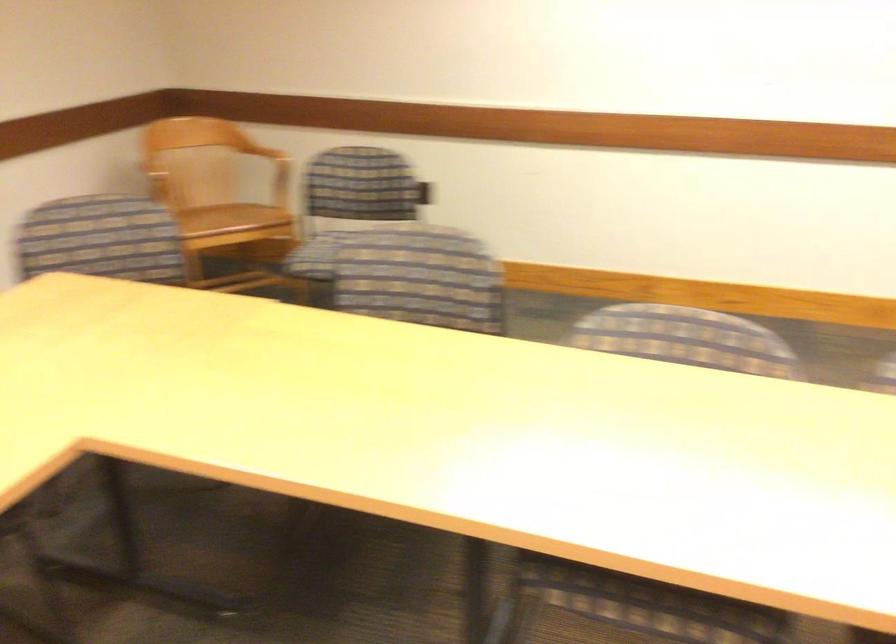
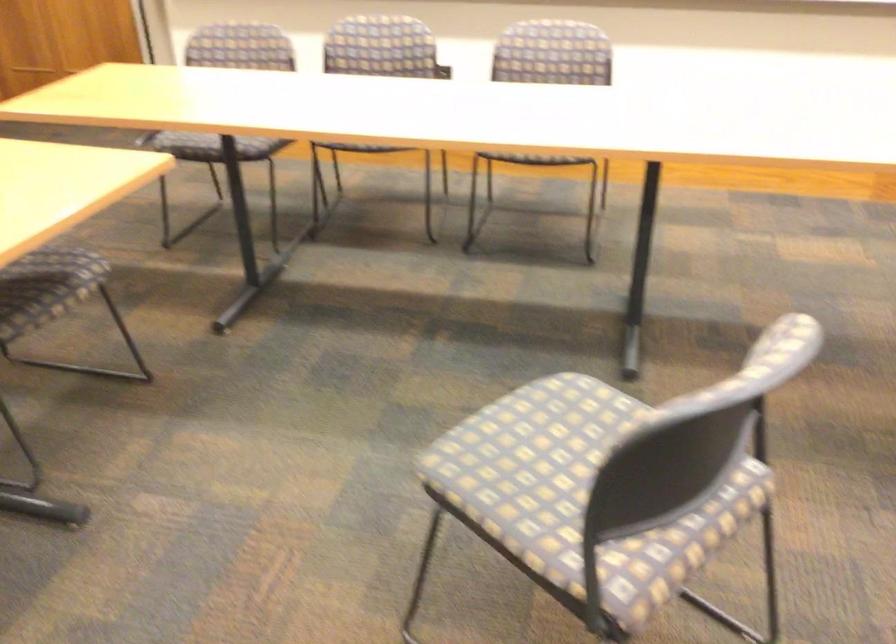
First-person continuous shooting, in which direction is the camera rotating?

The camera rotated toward right-down.